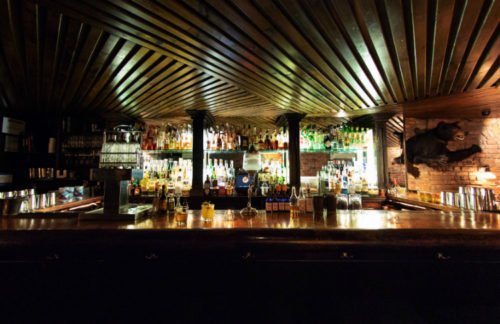
Where is `table`? The height and width of the screenshot is (324, 500). table is located at coordinates (280, 216).